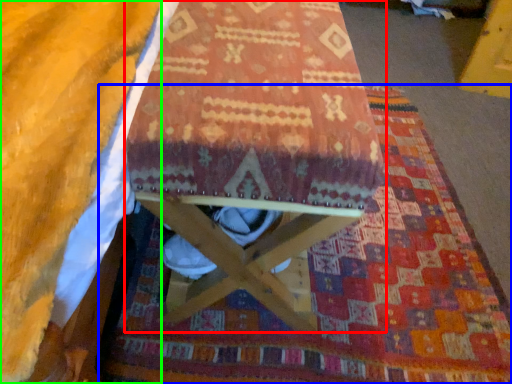
Question: Which is nearer to the furniture (highlighted by a red box)? mat (highlighted by a blue box) or blanket (highlighted by a green box).

Choices:
 (A) mat
 (B) blanket

Answer: (B)